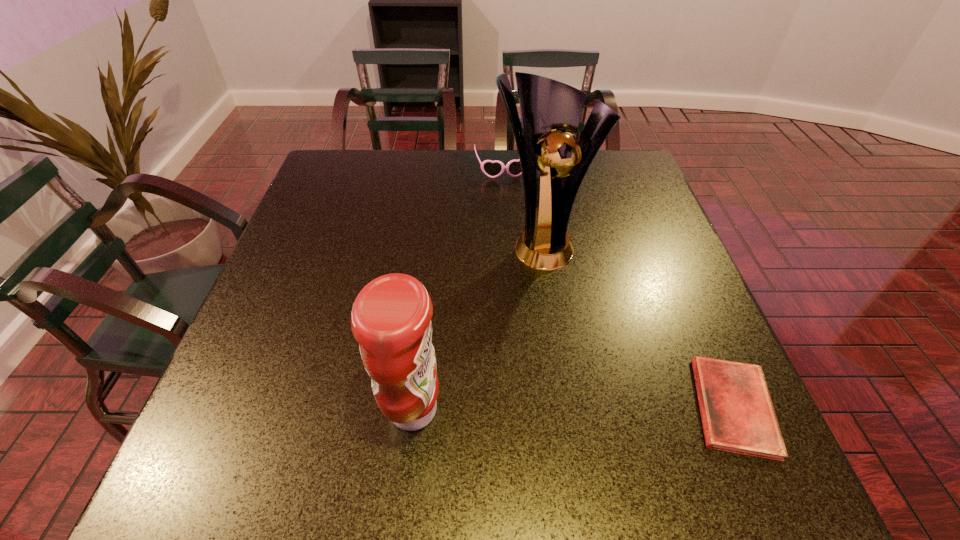
What are the coordinates of `the second tallest object` in the screenshot? It's located at (391, 317).

Locate an element on the screen. The height and width of the screenshot is (540, 960). the leftmost object is located at coordinates (391, 317).

The height and width of the screenshot is (540, 960). In order to click on the shortest object in this screenshot , I will do `click(737, 413)`.

The image size is (960, 540). In order to click on the rightmost object in this screenshot , I will do `click(737, 413)`.

This screenshot has height=540, width=960. I want to click on the second shortest object, so click(x=492, y=169).

The width and height of the screenshot is (960, 540). I want to click on sunglasses, so click(x=492, y=169).

At what (x,y) coordinates should I click in order to perform the action: click on the tallest object. Please return your answer as a coordinate pair (x, y). This screenshot has width=960, height=540. Looking at the image, I should click on (550, 110).

This screenshot has height=540, width=960. Find the location of `award`. award is located at coordinates (550, 110).

Locate an element on the screen. This screenshot has width=960, height=540. blank space located on the back of the third shortest object is located at coordinates (427, 288).

You are a GUI agent. You are given a task and a screenshot of the screen. Output one action in this format:
    pyautogui.click(x=<x>, y=<y>)
    Task: Click on the blank space located 0.210m on the back of the rightmost object
    This screenshot has height=540, width=960.
    Given the screenshot: What is the action you would take?
    pyautogui.click(x=679, y=282)